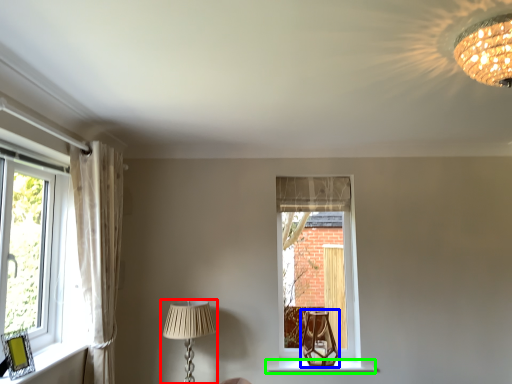
Question: Estimate the real-world distances between objects in this image. Which object is farther from lamp (highlighted by a red box), table lamp (highlighted by a blue box) or window sill (highlighted by a green box)?

Choices:
 (A) table lamp
 (B) window sill

Answer: (A)